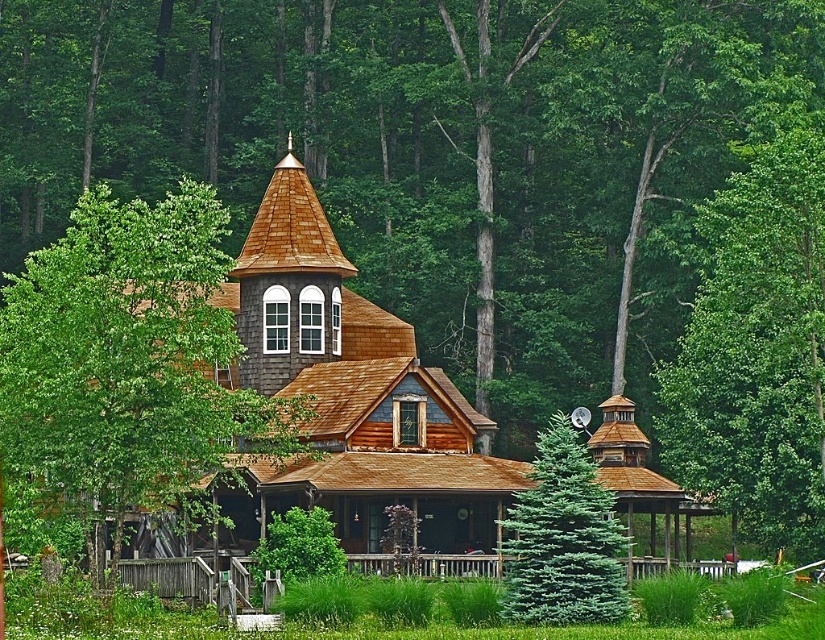
You are a painter standing at the base of the green fir at center. Looking up, you notice the green leafy tree at upper center. Which tree appears wider from your vantage point?

The green leafy tree at upper center appears wider than the green fir at center because its width surpasses that of the green fir at center.

You are a bird flying over the forest and want to land on a tree. You see the green leafy tree at upper center and the green fir at center. Which tree is higher up in the air?

The green leafy tree at upper center is positioned over the green fir at center, so it is higher up in the air.

You are standing in front of the rustic house and notice two trees in the center of the image. Which tree, the green leafy tree at center or the green fir at center, reaches a greater height?

The green leafy tree at center is much taller than the green fir at center, so it reaches a greater height.